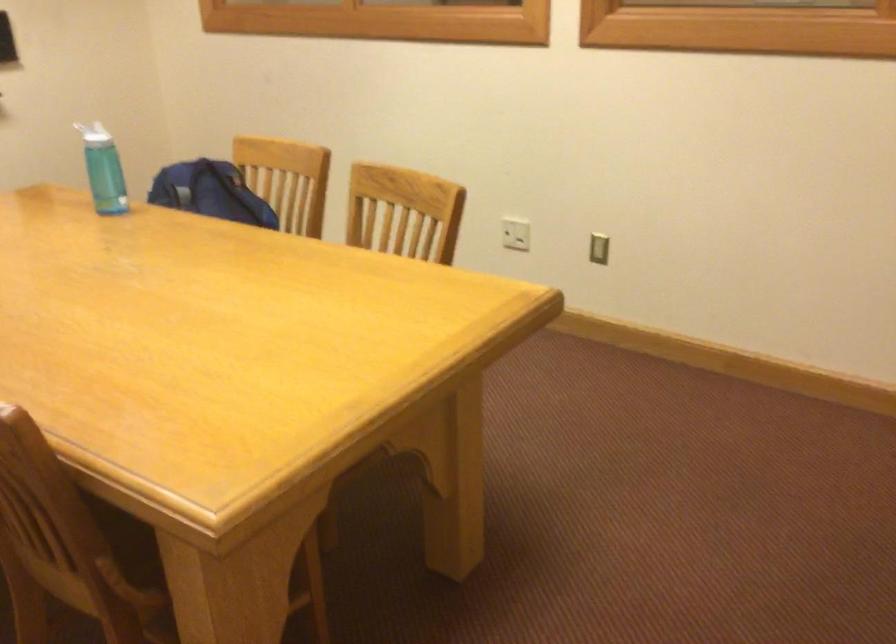
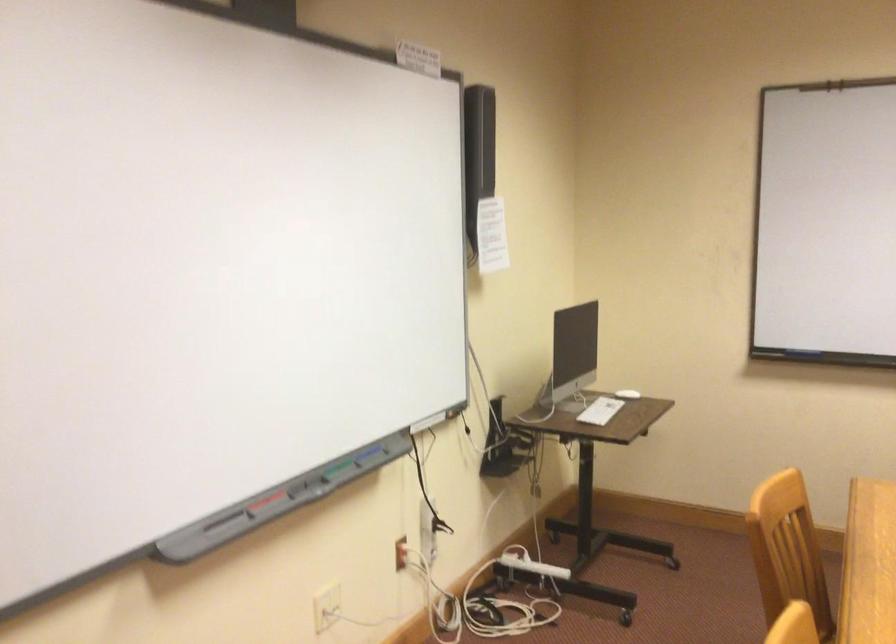
Question: The images are taken continuously from a first-person perspective. In which direction is your viewpoint rotating?

Choices:
 (A) Left
 (B) Right
 (C) Up
 (D) Down

Answer: (A)